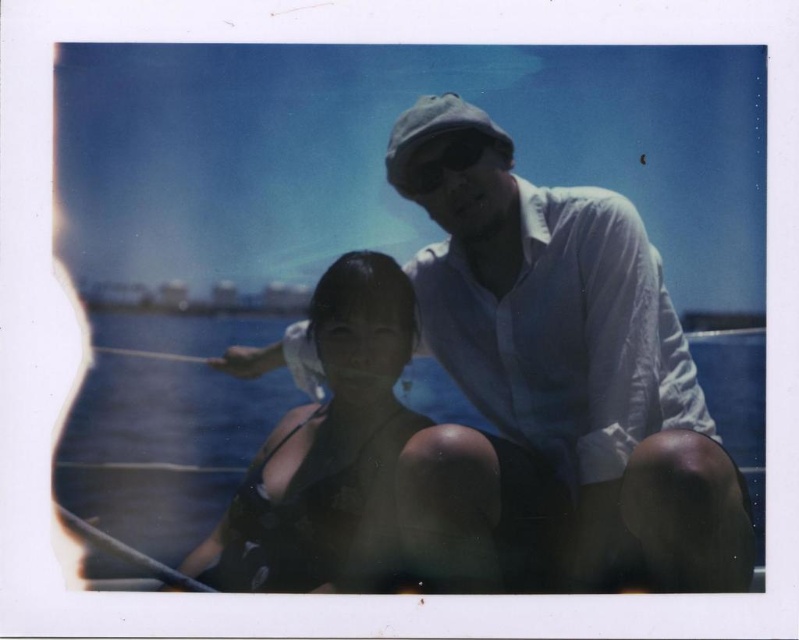
Consider the image. You are a photographer analyzing this vintage Polaroid photo. You notice the white cotton shirt at upper center and the clear blue water at center. Which object occupies a larger portion of the image vertically?

The white cotton shirt at upper center is much taller than the clear blue water at center, so it occupies a larger vertical portion of the image.